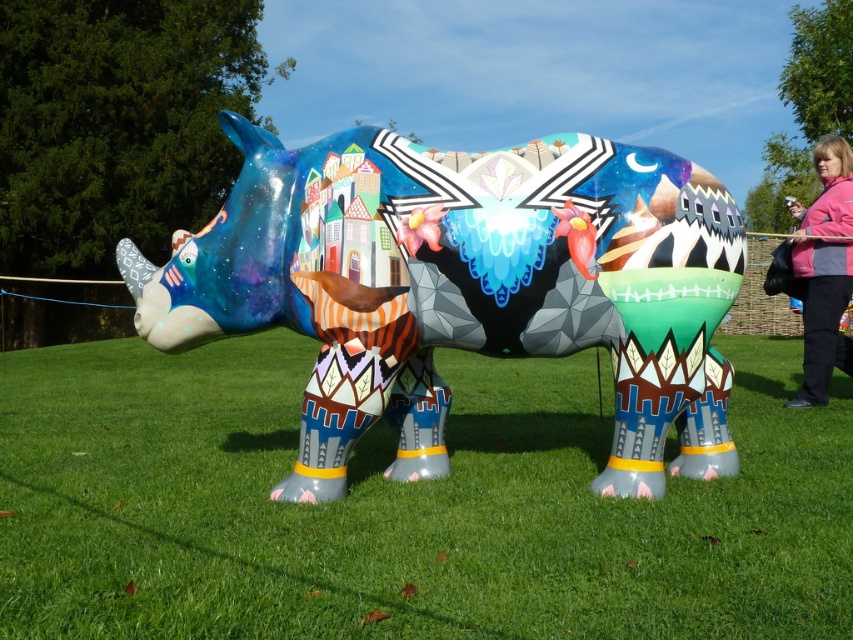
You are standing at the center of the image and want to walk to the green grass at lower center. According to the coordinates provided, in which direction should you move?

The green grass at lower center is located at coordinates point [404,506]. Since you are at the center, you should move towards the lower right direction to reach it.

You are an artist planning to paint a mural of the glossy painted rhino at center and the pink fleece jacket at right. Based on their positions in the image, which object should you paint first to ensure proper layering?

The pink fleece jacket at right should be painted first because the glossy painted rhino at center is located below it, meaning the jacket needs to be placed over the rhino in the final composition.

You are standing in front of the sculpture and want to place a small flower pot on the ground near the glossy painted rhino at center. Where should you place it so that it is directly in front of the green grass at lower center?

You should place the small flower pot directly in front of the green grass at lower center since the green grass at lower center is positioned under the glossy painted rhino at center, meaning the grass is located beneath it. Therefore, placing the flower pot in front of the grass would position it under the rhino.